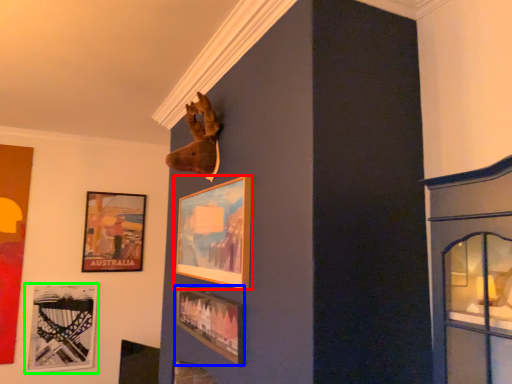
Question: Based on their relative distances, which object is farther from picture frame (highlighted by a red box)? Choose from picture frame (highlighted by a blue box) and picture frame (highlighted by a green box).

Choices:
 (A) picture frame
 (B) picture frame

Answer: (B)